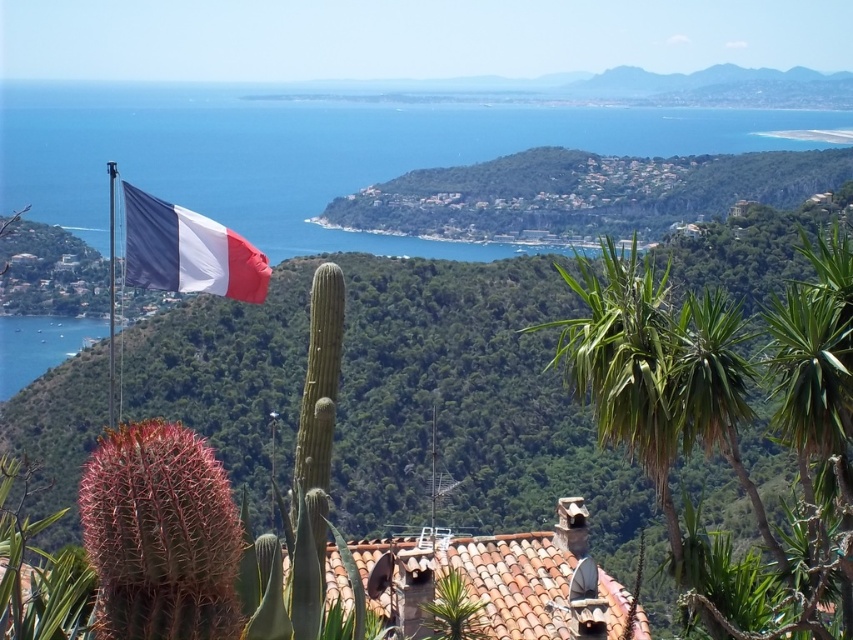
Can you confirm if blue water at upper center is positioned to the right of green leafy palm tree at center?

In fact, blue water at upper center is to the left of green leafy palm tree at center.

Can you confirm if blue water at upper center is bigger than green leafy palm tree at center?

Correct, blue water at upper center is larger in size than green leafy palm tree at center.

Between point (297, 100) and point (610, 410), which one is positioned in front?

Point (610, 410) is in front.

At what (x,y) coordinates should I click in order to perform the action: click on blue water at upper center. Please return your answer as a coordinate pair (x, y). The width and height of the screenshot is (853, 640). Looking at the image, I should click on (316, 152).

Consider the image. Can you confirm if blue water at upper center is positioned above matte fabric flag at upper left?

Yes.

Describe the element at coordinates (316, 152) in the screenshot. This screenshot has width=853, height=640. I see `blue water at upper center` at that location.

I want to click on blue water at upper center, so click(316, 152).

Is point (616, 316) farther from viewer compared to point (157, 212)?

No.

Does green leafy palm tree at center have a larger size compared to matte fabric flag at upper left?

Indeed, green leafy palm tree at center has a larger size compared to matte fabric flag at upper left.

Measure the distance between green leafy palm tree at center and camera.

They are 36.17 meters apart.

Identify the location of green leafy palm tree at center. pyautogui.click(x=625, y=364).